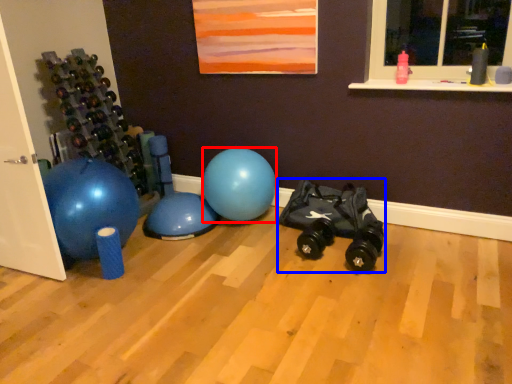
Question: Which point is further to the camera, ball (highlighted by a red box) or toy car (highlighted by a blue box)?

Choices:
 (A) ball
 (B) toy car

Answer: (A)